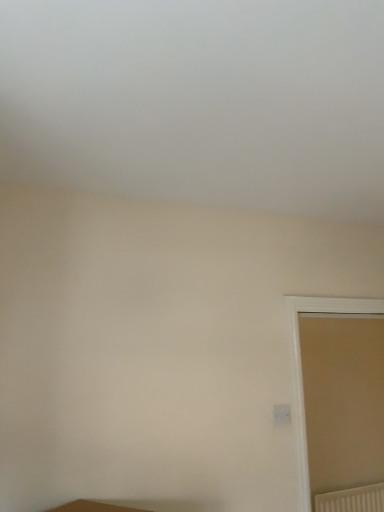
Where is `beige matte door at right`? The image size is (384, 512). beige matte door at right is located at coordinates (301, 368).

This screenshot has height=512, width=384. What do you see at coordinates (301, 368) in the screenshot?
I see `beige matte door at right` at bounding box center [301, 368].

The width and height of the screenshot is (384, 512). Describe the element at coordinates (352, 499) in the screenshot. I see `white textured radiator at lower right` at that location.

What is the approximate height of white textured radiator at lower right?

It is 10.27 inches.

In order to click on white textured radiator at lower right in this screenshot , I will do `click(352, 499)`.

At what (x,y) coordinates should I click in order to perform the action: click on beige matte door at right. Please return your answer as a coordinate pair (x, y). Image resolution: width=384 pixels, height=512 pixels. Looking at the image, I should click on (301, 368).

Between beige matte door at right and white textured radiator at lower right, which one appears on the right side from the viewer's perspective?

white textured radiator at lower right.

In the image, is beige matte door at right positioned in front of or behind white textured radiator at lower right?

beige matte door at right is in front of white textured radiator at lower right.

Considering the positions of points (300, 383) and (360, 510), is point (300, 383) farther from camera compared to point (360, 510)?

That is False.

From the image's perspective, is beige matte door at right above or below white textured radiator at lower right?

From the image's perspective, beige matte door at right appears above white textured radiator at lower right.

From a real-world perspective, is beige matte door at right physically below white textured radiator at lower right?

No, from a real-world perspective, beige matte door at right is not under white textured radiator at lower right.

Does beige matte door at right have a lesser width compared to white textured radiator at lower right?

No, beige matte door at right is not thinner than white textured radiator at lower right.

Based on the photo, is beige matte door at right taller or shorter than white textured radiator at lower right?

Considering their sizes, beige matte door at right has more height than white textured radiator at lower right.

Considering the sizes of beige matte door at right and white textured radiator at lower right in the image, is beige matte door at right bigger or smaller than white textured radiator at lower right?

Considering their sizes, beige matte door at right takes up more space than white textured radiator at lower right.

Is beige matte door at right completely or partially outside of white textured radiator at lower right?

Yes, beige matte door at right is located beyond the bounds of white textured radiator at lower right.

Would you consider beige matte door at right to be distant from white textured radiator at lower right?

Yes, beige matte door at right is far from white textured radiator at lower right.

Could you tell me if beige matte door at right is turned towards white textured radiator at lower right?

No, beige matte door at right is not aimed at white textured radiator at lower right.

Measure the distance between beige matte door at right and white textured radiator at lower right.

5.42 feet.

Where is `window lying above the white textured radiator at lower right (from the image's perspective)`? Image resolution: width=384 pixels, height=512 pixels. window lying above the white textured radiator at lower right (from the image's perspective) is located at coordinates (301, 368).

Considering the positions of objects white textured radiator at lower right and beige matte door at right in the image provided, who is more to the left, white textured radiator at lower right or beige matte door at right?

From the viewer's perspective, beige matte door at right appears more on the left side.

Consider the image. Does white textured radiator at lower right lie in front of beige matte door at right?

No, it is behind beige matte door at right.

Does point (333, 494) come farther from viewer compared to point (298, 327)?

No, it is in front of (298, 327).

From the image's perspective, is white textured radiator at lower right above beige matte door at right?

No, from the image's perspective, white textured radiator at lower right is not on top of beige matte door at right.

From the picture: From a real-world perspective, is white textured radiator at lower right positioned above or below beige matte door at right?

Clearly, from a real-world perspective, white textured radiator at lower right is below beige matte door at right.

Does white textured radiator at lower right have a greater width compared to beige matte door at right?

Incorrect, the width of white textured radiator at lower right does not surpass that of beige matte door at right.

Looking at this image, between white textured radiator at lower right and beige matte door at right, which one has less height?

With less height is white textured radiator at lower right.

Looking at the image, does white textured radiator at lower right seem bigger or smaller compared to beige matte door at right?

Clearly, white textured radiator at lower right is smaller in size than beige matte door at right.

Can we say white textured radiator at lower right lies outside beige matte door at right?

white textured radiator at lower right lies outside beige matte door at right's area.

Is white textured radiator at lower right next to beige matte door at right and touching it?

There is a gap between white textured radiator at lower right and beige matte door at right.

Is white textured radiator at lower right positioned with its back to beige matte door at right?

No, white textured radiator at lower right is not facing away from beige matte door at right.

How different are the orientations of white textured radiator at lower right and beige matte door at right in degrees?

There is a 0.896-degree angle between the facing directions of white textured radiator at lower right and beige matte door at right.

Locate an element on the screen. The height and width of the screenshot is (512, 384). window in front of the white textured radiator at lower right is located at coordinates (301, 368).

Where is `radiator behind the beige matte door at right`? radiator behind the beige matte door at right is located at coordinates (352, 499).

This screenshot has height=512, width=384. In order to click on radiator beneath the beige matte door at right (from a real-world perspective) in this screenshot , I will do `click(352, 499)`.